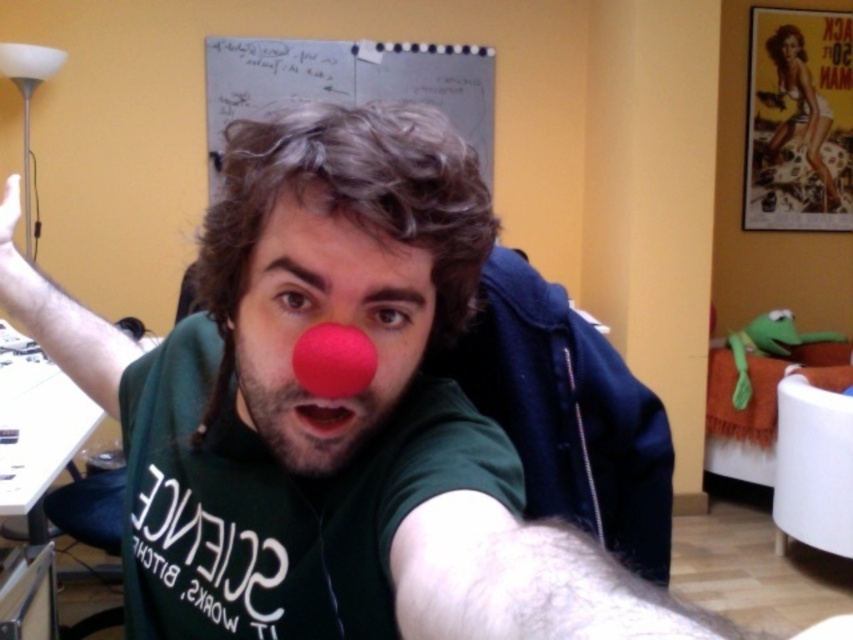
Where is the matte red nose at center located in the image?

The matte red nose at center is located at point coordinates of 0.500 in the x axis and 0.382 in the y axis.